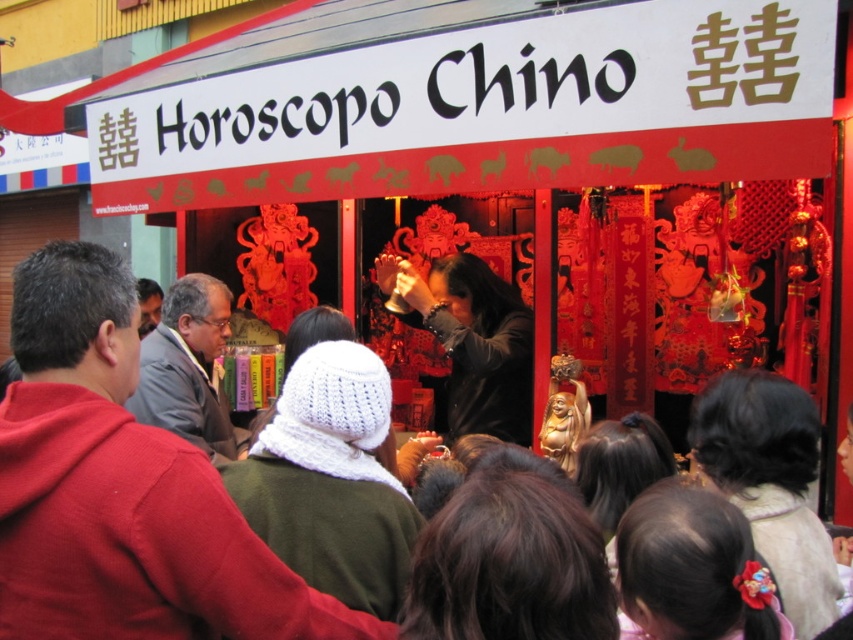
Question: Which point is farther to the camera?

Choices:
 (A) dark brown leather jacket at center
 (B) gray fabric jacket at center

Answer: (A)

Question: Is the position of dark brown leather jacket at center more distant than that of gray fabric jacket at center?

Choices:
 (A) no
 (B) yes

Answer: (B)

Question: Among these points, which one is nearest to the camera?

Choices:
 (A) (488, 307)
 (B) (219, 420)

Answer: (B)

Question: Is dark brown leather jacket at center to the right of gray fabric jacket at center from the viewer's perspective?

Choices:
 (A) no
 (B) yes

Answer: (B)

Question: Which point is closer to the camera taking this photo?

Choices:
 (A) (216, 413)
 (B) (454, 259)

Answer: (A)

Question: Is dark brown leather jacket at center smaller than gray fabric jacket at center?

Choices:
 (A) no
 (B) yes

Answer: (A)